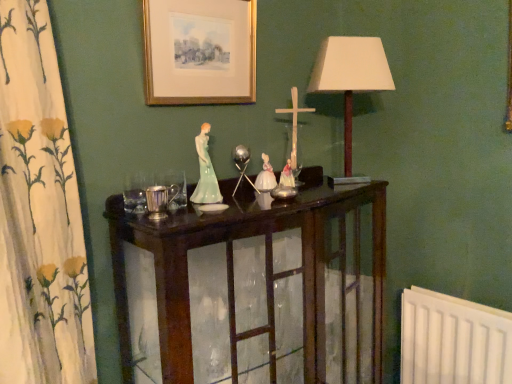
Question: Can you confirm if dark wood cabinet at center is positioned to the left of white fabric lampshade at upper right?

Choices:
 (A) yes
 (B) no

Answer: (A)

Question: Is dark wood cabinet at center bigger than white fabric lampshade at upper right?

Choices:
 (A) yes
 (B) no

Answer: (A)

Question: Is dark wood cabinet at center in front of white fabric lampshade at upper right?

Choices:
 (A) yes
 (B) no

Answer: (A)

Question: Is dark wood cabinet at center wider than white fabric lampshade at upper right?

Choices:
 (A) no
 (B) yes

Answer: (B)

Question: Considering the relative sizes of dark wood cabinet at center and white fabric lampshade at upper right in the image provided, is dark wood cabinet at center taller than white fabric lampshade at upper right?

Choices:
 (A) yes
 (B) no

Answer: (A)

Question: From a real-world perspective, is dark wood cabinet at center physically located above or below gold-framed print at upper center?

Choices:
 (A) below
 (B) above

Answer: (A)

Question: Do you think dark wood cabinet at center is within gold-framed print at upper center, or outside of it?

Choices:
 (A) inside
 (B) outside

Answer: (B)

Question: Considering the relative positions of dark wood cabinet at center and gold-framed print at upper center in the image provided, is dark wood cabinet at center to the left or to the right of gold-framed print at upper center?

Choices:
 (A) left
 (B) right

Answer: (B)

Question: In terms of height, does dark wood cabinet at center look taller or shorter compared to gold-framed print at upper center?

Choices:
 (A) short
 (B) tall

Answer: (B)

Question: From the image's perspective, relative to dark wood cabinet at center, is white fabric lampshade at upper right above or below?

Choices:
 (A) above
 (B) below

Answer: (A)

Question: In terms of width, does white fabric lampshade at upper right look wider or thinner when compared to dark wood cabinet at center?

Choices:
 (A) wide
 (B) thin

Answer: (B)

Question: From their relative heights in the image, would you say white fabric lampshade at upper right is taller or shorter than dark wood cabinet at center?

Choices:
 (A) short
 (B) tall

Answer: (A)

Question: Is white fabric lampshade at upper right bigger or smaller than dark wood cabinet at center?

Choices:
 (A) small
 (B) big

Answer: (A)

Question: Based on their positions, is dark wood cabinet at center located to the left or right of white fabric lampshade at upper right?

Choices:
 (A) left
 (B) right

Answer: (A)

Question: Looking at their shapes, would you say dark wood cabinet at center is wider or thinner than white fabric lampshade at upper right?

Choices:
 (A) wide
 (B) thin

Answer: (A)